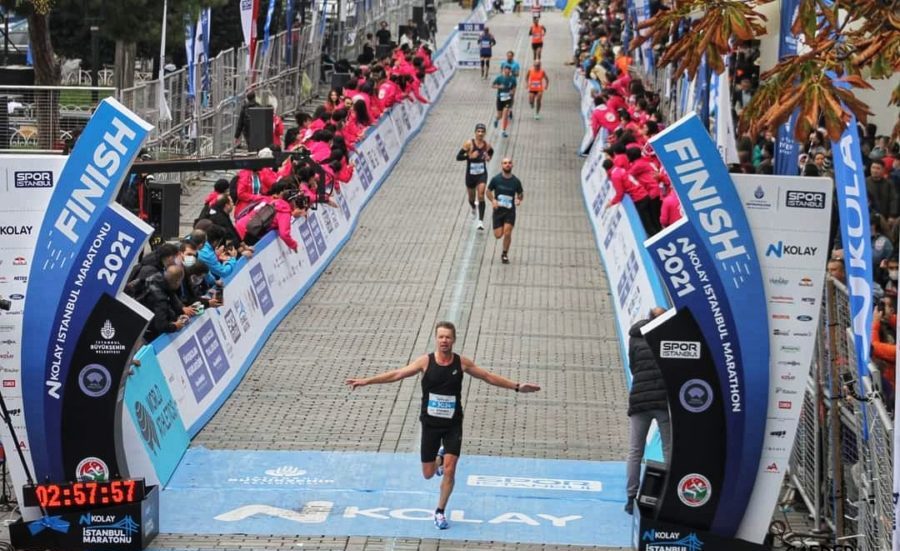
Image resolution: width=900 pixels, height=551 pixels. What are the coordinates of `red digital clock` in the screenshot? It's located at (52, 499).